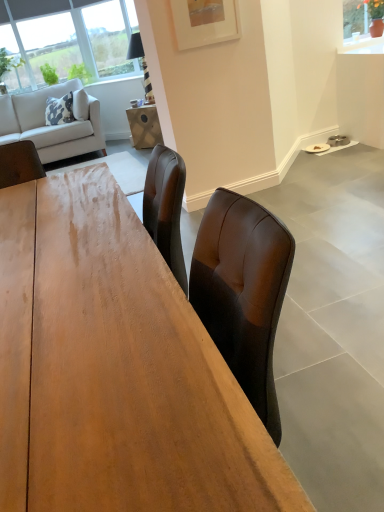
Question: Is white matte picture frame at upper center looking in the opposite direction of wooden table at center?

Choices:
 (A) no
 (B) yes

Answer: (A)

Question: Is white matte picture frame at upper center positioned before wooden table at center?

Choices:
 (A) yes
 (B) no

Answer: (B)

Question: Would you say white matte picture frame at upper center is a long distance from wooden table at center?

Choices:
 (A) no
 (B) yes

Answer: (B)

Question: Is white matte picture frame at upper center located outside wooden table at center?

Choices:
 (A) no
 (B) yes

Answer: (B)

Question: From the image's perspective, would you say white matte picture frame at upper center is positioned over wooden table at center?

Choices:
 (A) no
 (B) yes

Answer: (B)

Question: Can you confirm if white matte picture frame at upper center is wider than wooden table at center?

Choices:
 (A) yes
 (B) no

Answer: (B)

Question: Is wooden table at center taller than white matte picture frame at upper center?

Choices:
 (A) no
 (B) yes

Answer: (B)

Question: Is wooden table at center not close to white matte picture frame at upper center?

Choices:
 (A) no
 (B) yes

Answer: (B)

Question: Does wooden table at center come in front of white matte picture frame at upper center?

Choices:
 (A) yes
 (B) no

Answer: (A)

Question: Considering the relative sizes of wooden table at center and white matte picture frame at upper center in the image provided, is wooden table at center bigger than white matte picture frame at upper center?

Choices:
 (A) no
 (B) yes

Answer: (B)

Question: Does wooden table at center touch white matte picture frame at upper center?

Choices:
 (A) yes
 (B) no

Answer: (B)

Question: From a real-world perspective, is wooden table at center over white matte picture frame at upper center?

Choices:
 (A) no
 (B) yes

Answer: (A)

Question: Can you confirm if light gray fabric couch at upper left is positioned to the left of wooden table at center?

Choices:
 (A) no
 (B) yes

Answer: (B)